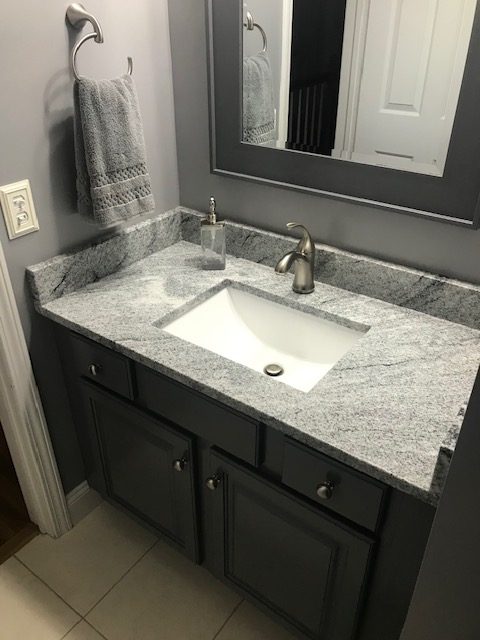
Find the location of a particular element. Image resolution: width=480 pixels, height=640 pixels. door is located at coordinates (414, 116).